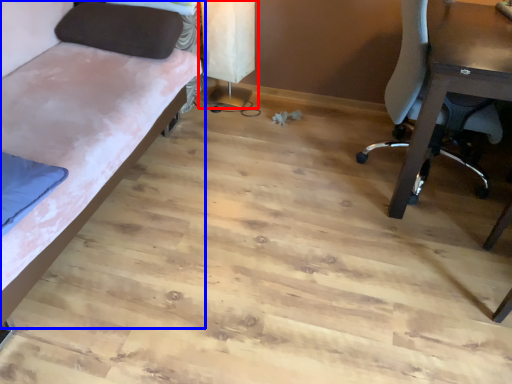
Question: Which point is further to the camera, table lamp (highlighted by a red box) or studio couch (highlighted by a blue box)?

Choices:
 (A) table lamp
 (B) studio couch

Answer: (A)